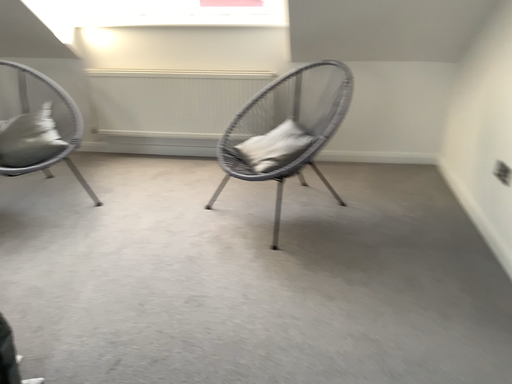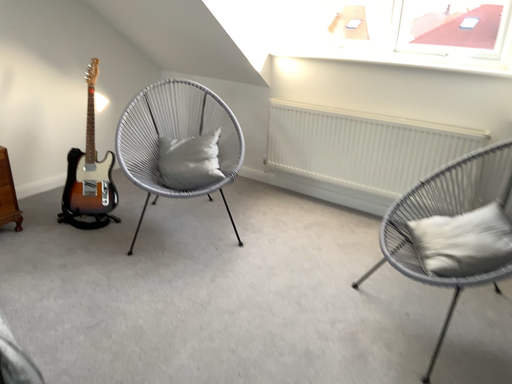
Question: Which way did the camera rotate in the video?

Choices:
 (A) rotated upward
 (B) rotated downward

Answer: (A)